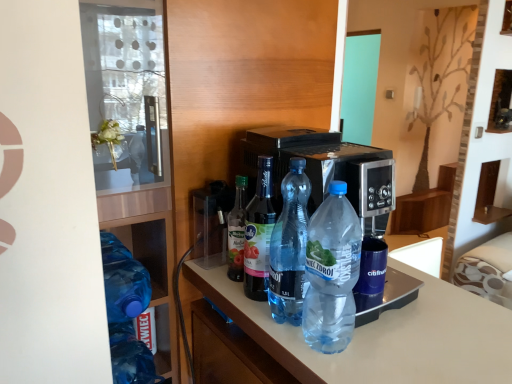
How much space does transparent plastic bottle at center, the 2th bottle when ordered from right to left, occupy vertically?

transparent plastic bottle at center, the 2th bottle when ordered from right to left, is 12.83 inches tall.

Based on the photo, what is the approximate width of transparent plastic bottles at left?

transparent plastic bottles at left is 20.98 inches wide.

Find the location of a particular element. This screenshot has height=384, width=512. blue translucent bottle at left, which is the 5th bottle from right to left is located at coordinates (130, 356).

The height and width of the screenshot is (384, 512). What do you see at coordinates (130, 356) in the screenshot?
I see `blue translucent bottle at left, which appears as the first bottle when viewed from the left` at bounding box center [130, 356].

This screenshot has height=384, width=512. I want to click on transparent plastic bottle at center, the 2th bottle when ordered from right to left, so click(290, 247).

Is blue translucent bottle at left, which appears as the first bottle when viewed from the left, taller or shorter than clear plastic bottle at center, which appears as the 3th bottle when viewed from the right?

In the image, blue translucent bottle at left, which appears as the first bottle when viewed from the left, appears to be shorter than clear plastic bottle at center, which appears as the 3th bottle when viewed from the right.

From a real-world perspective, relative to clear plastic bottle at center, which appears as the 3th bottle when viewed from the right, is blue translucent bottle at left, which appears as the first bottle when viewed from the left, vertically above or below?

blue translucent bottle at left, which appears as the first bottle when viewed from the left, is below clear plastic bottle at center, which appears as the 3th bottle when viewed from the right.

Who is bigger, blue translucent bottle at left, which appears as the first bottle when viewed from the left, or clear plastic bottle at center, which appears as the 3th bottle when viewed from the right?

Bigger between the two is blue translucent bottle at left, which appears as the first bottle when viewed from the left.

From the image's perspective, is blue translucent bottle at left, which appears as the first bottle when viewed from the left, above or below clear plastic bottle at center, which appears as the 3th bottle when viewed from the right?

Based on their image positions, blue translucent bottle at left, which appears as the first bottle when viewed from the left, is located beneath clear plastic bottle at center, which appears as the 3th bottle when viewed from the right.

Is clear plastic bottle at center, which appears as the 3th bottle when viewed from the right, positioned with its back to transparent plastic bottles at left?

No, clear plastic bottle at center, which appears as the 3th bottle when viewed from the right,'s orientation is not away from transparent plastic bottles at left.

Locate an element on the screen. shelf below the clear plastic bottle at center, which appears as the 3th bottle when viewed from the right (from the image's perspective) is located at coordinates (134, 147).

How many degrees apart are the facing directions of clear plastic bottle at center, marked as the 3th bottle in a left-to-right arrangement, and transparent plastic bottles at left?

They differ by 4.38 degrees in their facing directions.

Which point is more forward, (267, 157) or (155, 346)?

Positioned in front is point (267, 157).

Is transparent plastic bottles at left inside transparent plastic bottle at center, which appears as the fifth bottle when viewed from the left?

No, transparent plastic bottles at left is located outside of transparent plastic bottle at center, which appears as the fifth bottle when viewed from the left.

Which is closer to the camera, (334, 308) or (89, 42)?

Point (334, 308).

Is transparent plastic bottle at center, the 1th bottle viewed from the right, aimed at transparent plastic bottles at left?

No, transparent plastic bottle at center, the 1th bottle viewed from the right, does not turn towards transparent plastic bottles at left.

From the picture: Does transparent plastic bottle at center, which appears as the fifth bottle when viewed from the left, have a larger size compared to transparent plastic bottles at left?

No.

How different are the orientations of clear plastic bottle at center, marked as the 3th bottle in a left-to-right arrangement, and blue translucent bottle at left, which appears as the first bottle when viewed from the left, in degrees?

They differ by 2.61 degrees in their facing directions.

Measure the distance between clear plastic bottle at center, marked as the 3th bottle in a left-to-right arrangement, and blue translucent bottle at left, which appears as the first bottle when viewed from the left.

clear plastic bottle at center, marked as the 3th bottle in a left-to-right arrangement, is 39.31 centimeters from blue translucent bottle at left, which appears as the first bottle when viewed from the left.

In the scene shown: From the image's perspective, does clear plastic bottle at center, which appears as the 3th bottle when viewed from the right, appear higher than blue translucent bottle at left, which is the 5th bottle from right to left?

Yes, from the image's perspective, clear plastic bottle at center, which appears as the 3th bottle when viewed from the right, is above blue translucent bottle at left, which is the 5th bottle from right to left.

Which of these two, clear plastic bottle at center, marked as the 3th bottle in a left-to-right arrangement, or blue translucent bottle at left, which appears as the first bottle when viewed from the left, is bigger?

blue translucent bottle at left, which appears as the first bottle when viewed from the left.

Considering the positions of point (298, 270) and point (161, 228), is point (298, 270) closer or farther from the camera than point (161, 228)?

Point (298, 270).

In the image, is transparent plastic bottle at center, the 2th bottle when ordered from right to left, positioned in front of or behind transparent plastic bottles at left?

Visually, transparent plastic bottle at center, the 2th bottle when ordered from right to left, is located in front of transparent plastic bottles at left.

From the image's perspective, between transparent plastic bottle at center, the 2th bottle when ordered from right to left, and transparent plastic bottles at left, which one is located above?

From the image's view, transparent plastic bottles at left is above.

Find the location of a particular element. The image size is (512, 384). shelf to the left of transparent plastic bottle at center, which appears as the fourth bottle when viewed from the left is located at coordinates (134, 147).

From the image's perspective, between transparent plastic bottle at center, which appears as the fourth bottle when viewed from the left, and translucent plastic bottle at center, which is the second bottle in left-to-right order, who is located below?

transparent plastic bottle at center, which appears as the fourth bottle when viewed from the left, is shown below in the image.

In the scene shown: Is transparent plastic bottle at center, the 2th bottle when ordered from right to left, looking in the opposite direction of translucent plastic bottle at center, placed as the 4th bottle when sorted from right to left?

Yes, transparent plastic bottle at center, the 2th bottle when ordered from right to left, is facing away from translucent plastic bottle at center, placed as the 4th bottle when sorted from right to left.

Which object is closer to the camera, transparent plastic bottle at center, the 2th bottle when ordered from right to left, or translucent plastic bottle at center, which is the second bottle in left-to-right order?

Positioned in front is transparent plastic bottle at center, the 2th bottle when ordered from right to left.

From a real-world perspective, is transparent plastic bottle at center, which appears as the fourth bottle when viewed from the left, physically located above or below translucent plastic bottle at center, which is the second bottle in left-to-right order?

transparent plastic bottle at center, which appears as the fourth bottle when viewed from the left, is above translucent plastic bottle at center, which is the second bottle in left-to-right order.

Find the location of a particular element. The image size is (512, 384). the 2nd bottle below the clear plastic bottle at center, marked as the 3th bottle in a left-to-right arrangement (from the image's perspective) is located at coordinates (290, 247).

From a real-world perspective, who is located higher, transparent plastic bottle at center, the 2th bottle when ordered from right to left, or clear plastic bottle at center, marked as the 3th bottle in a left-to-right arrangement?

transparent plastic bottle at center, the 2th bottle when ordered from right to left.

In the image, is transparent plastic bottle at center, the 2th bottle when ordered from right to left, on the left side or the right side of clear plastic bottle at center, which appears as the 3th bottle when viewed from the right?

Based on their positions, transparent plastic bottle at center, the 2th bottle when ordered from right to left, is located to the right of clear plastic bottle at center, which appears as the 3th bottle when viewed from the right.

From the image's perspective, which bottle is the 4th one below the clear plastic bottle at center, marked as the 3th bottle in a left-to-right arrangement? Please provide its 2D coordinates.

[(130, 356)]

From a real-world perspective, starting from the transparent plastic bottles at left, which bottle is the 3rd one vertically above it? Please provide its 2D coordinates.

[(259, 233)]

Considering their positions, is translucent plastic bottle at center, placed as the 4th bottle when sorted from right to left, positioned further to transparent plastic bottles at left than clear plastic bottle at center, which appears as the 3th bottle when viewed from the right?

Based on the image, clear plastic bottle at center, which appears as the 3th bottle when viewed from the right, appears to be further to transparent plastic bottles at left.

Which object lies nearer to the anchor point transparent plastic bottle at center, the 1th bottle viewed from the right, translucent plastic bottle at center, which is the second bottle in left-to-right order, or transparent plastic bottles at left?

translucent plastic bottle at center, which is the second bottle in left-to-right order, is closer to transparent plastic bottle at center, the 1th bottle viewed from the right.

Consider the image. Estimate the real-world distances between objects in this image. Which object is further from blue translucent bottle at left, which is the 5th bottle from right to left, transparent plastic bottle at center, the 1th bottle viewed from the right, or clear plastic bottle at center, marked as the 3th bottle in a left-to-right arrangement?

The object further to blue translucent bottle at left, which is the 5th bottle from right to left, is transparent plastic bottle at center, the 1th bottle viewed from the right.

When comparing their distances from clear plastic bottle at center, which appears as the 3th bottle when viewed from the right, does transparent plastic bottle at center, the 2th bottle when ordered from right to left, or transparent plastic bottle at center, which appears as the fifth bottle when viewed from the left, seem closer?

Based on the image, transparent plastic bottle at center, the 2th bottle when ordered from right to left, appears to be nearer to clear plastic bottle at center, which appears as the 3th bottle when viewed from the right.

From the picture: Which object lies nearer to the anchor point translucent plastic bottle at center, placed as the 4th bottle when sorted from right to left, clear plastic bottle at center, which appears as the 3th bottle when viewed from the right, or transparent plastic bottles at left?

clear plastic bottle at center, which appears as the 3th bottle when viewed from the right, lies closer to translucent plastic bottle at center, placed as the 4th bottle when sorted from right to left, than the other object.

From the image, which object appears to be farther from transparent plastic bottle at center, the 1th bottle viewed from the right, transparent plastic bottles at left or translucent plastic bottle at center, which is the second bottle in left-to-right order?

Based on the image, transparent plastic bottles at left appears to be further to transparent plastic bottle at center, the 1th bottle viewed from the right.

When comparing their distances from transparent plastic bottles at left, does clear plastic bottle at center, marked as the 3th bottle in a left-to-right arrangement, or blue translucent bottle at left, which is the 5th bottle from right to left, seem further?

blue translucent bottle at left, which is the 5th bottle from right to left, lies further to transparent plastic bottles at left than the other object.

When comparing their distances from transparent plastic bottle at center, the 2th bottle when ordered from right to left, does clear plastic bottle at center, which appears as the 3th bottle when viewed from the right, or transparent plastic bottles at left seem further?

transparent plastic bottles at left.

Find the location of a particular element. This screenshot has width=512, height=384. bottle between transparent plastic bottle at center, which appears as the fifth bottle when viewed from the left, and clear plastic bottle at center, marked as the 3th bottle in a left-to-right arrangement, along the z-axis is located at coordinates (290, 247).

You are a GUI agent. You are given a task and a screenshot of the screen. Output one action in this format:
    pyautogui.click(x=<x>, y=<y>)
    Task: Click on the shelf between translucent plastic bottle at center, placed as the 4th bottle when sorted from right to left, and blue translucent bottle at left, which appears as the first bottle when viewed from the left, in the vertical direction
    Image resolution: width=512 pixels, height=384 pixels.
    Given the screenshot: What is the action you would take?
    pyautogui.click(x=134, y=147)